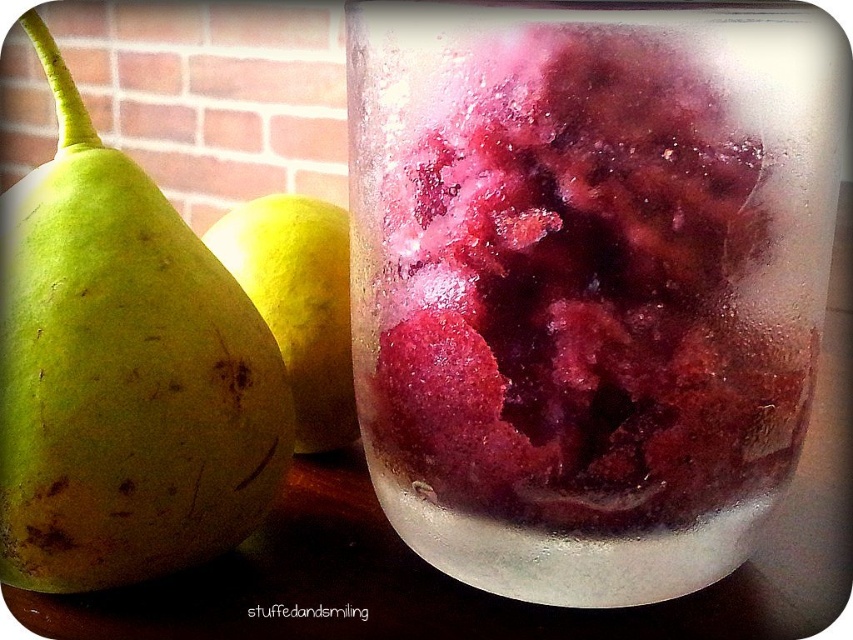
Looking at this image, you are a bartender preparing a drink and need to place the green matte pear at left and yellow matte pear at center on a shelf. The shelf has limited space. Which pear should you place first to ensure both fit properly?

The green matte pear at left should be placed first since it is positioned under the yellow matte pear at center, indicating it is smaller and requires less space.

Looking at this image, you are holding a small toy that needs to be placed between the frosted glass jar at center and the yellow matte pear at center. Which object should you place it closer to if you want the toy to be closer to the viewer?

You should place the toy closer to the frosted glass jar at center because it is closer to the viewer than the yellow matte pear at center.